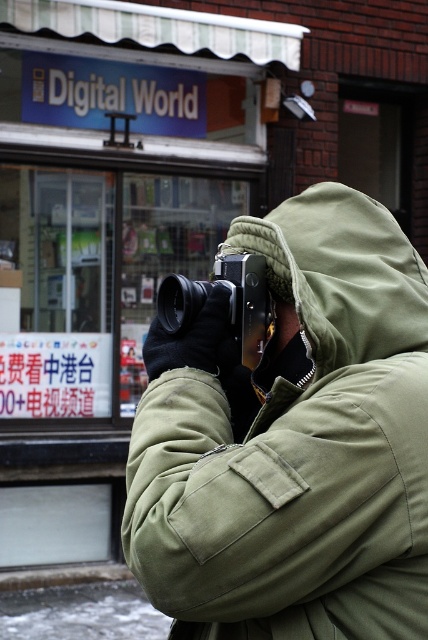
Question: Is green matte/twill trench coat at center in front of green fabric hood at center?

Choices:
 (A) yes
 (B) no

Answer: (A)

Question: Among these points, which one is farthest from the camera?

Choices:
 (A) (231, 262)
 (B) (415, 385)

Answer: (A)

Question: Which of the following is the farthest from the observer?

Choices:
 (A) (425, 310)
 (B) (228, 275)
 (C) (383, 246)

Answer: (B)

Question: In this image, where is green matte/twill trench coat at center located relative to metallic silver camera at center?

Choices:
 (A) left
 (B) right

Answer: (B)

Question: Which of these objects is positioned farthest from the green matte/twill trench coat at center?

Choices:
 (A) green fabric hood at center
 (B) metallic silver camera at center

Answer: (B)

Question: From the image, what is the correct spatial relationship of green matte/twill trench coat at center in relation to green fabric hood at center?

Choices:
 (A) above
 (B) below

Answer: (B)